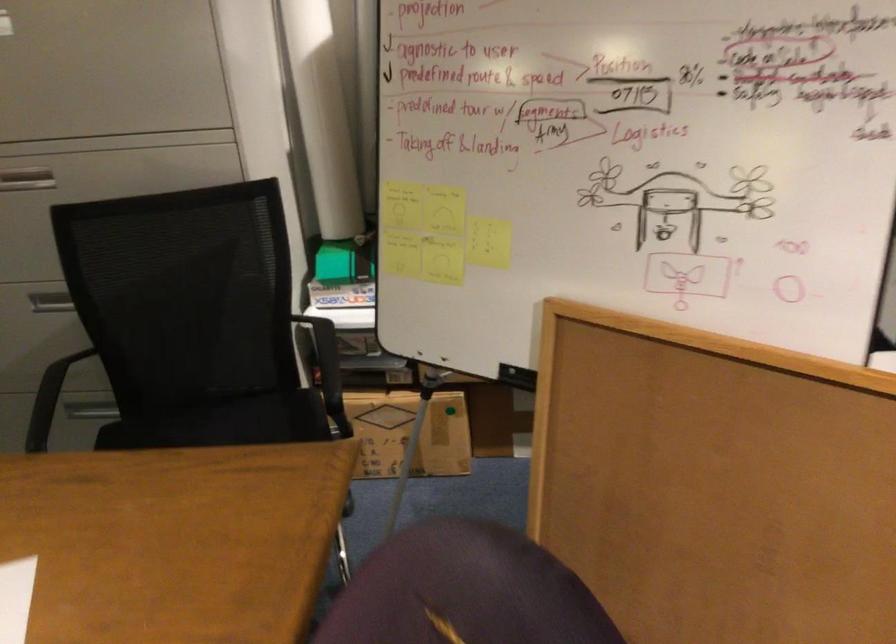
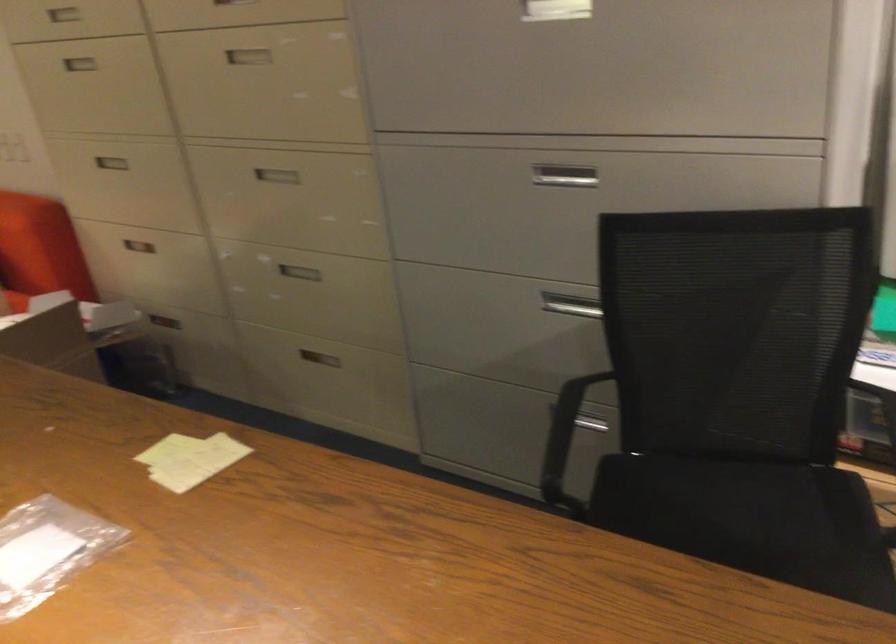
The point at (229, 429) is marked in the first image. Where is the corresponding point in the second image?

(739, 496)